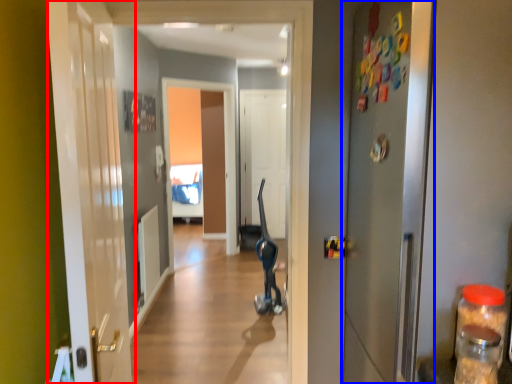
Question: Which point is closer to the camera, door (highlighted by a red box) or door (highlighted by a blue box)?

Choices:
 (A) door
 (B) door

Answer: (A)